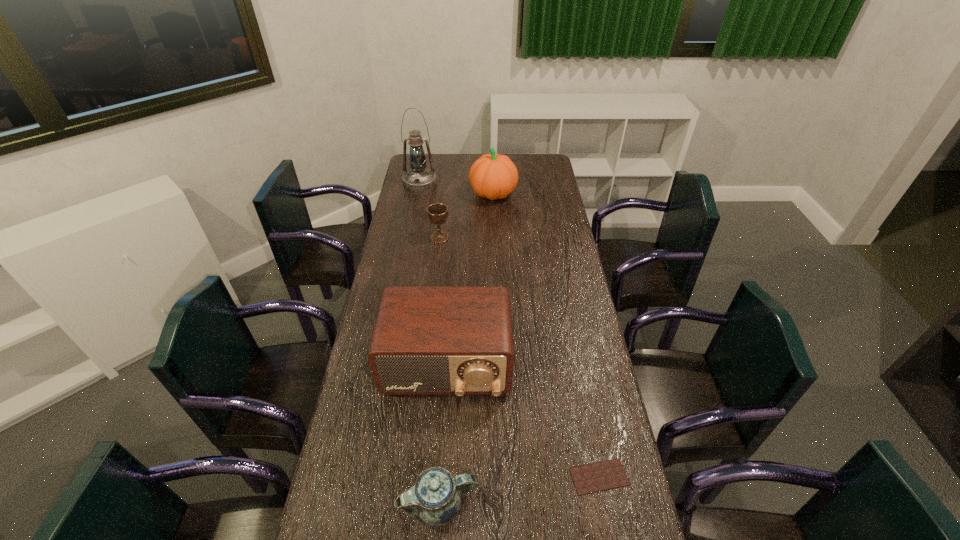
Where is `the tallest object`? The height and width of the screenshot is (540, 960). the tallest object is located at coordinates (418, 178).

At what (x,y) coordinates should I click in order to perform the action: click on pumpkin. Please return your answer as a coordinate pair (x, y). Image resolution: width=960 pixels, height=540 pixels. Looking at the image, I should click on (493, 176).

Identify the location of the third nearest object. Image resolution: width=960 pixels, height=540 pixels. (458, 341).

Identify the location of chalice. (437, 213).

Locate an element on the screen. This screenshot has width=960, height=540. chinaware is located at coordinates (435, 498).

The width and height of the screenshot is (960, 540). What are the coordinates of `the rightmost object` in the screenshot? It's located at (595, 477).

Identify the location of the shortest object. This screenshot has width=960, height=540. (595, 477).

Identify the location of free space located 0.280m on the front of the tallest object. The image size is (960, 540). (412, 224).

Locate an element on the screen. Image resolution: width=960 pixels, height=540 pixels. vacant space located 0.150m on the front of the pumpkin is located at coordinates 494,226.

The width and height of the screenshot is (960, 540). Find the location of `vacant space located on the front panel of the radio receiver`. vacant space located on the front panel of the radio receiver is located at coordinates (441, 454).